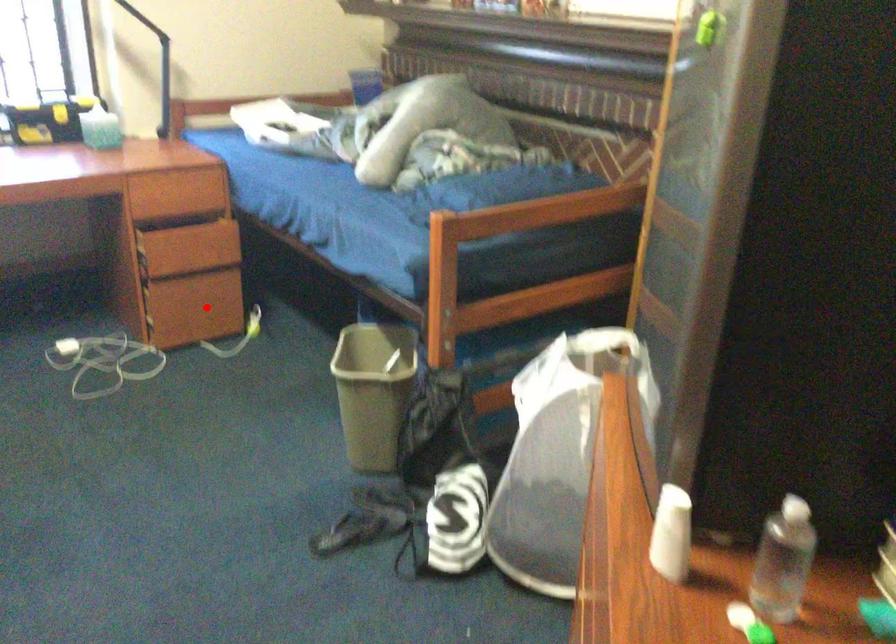
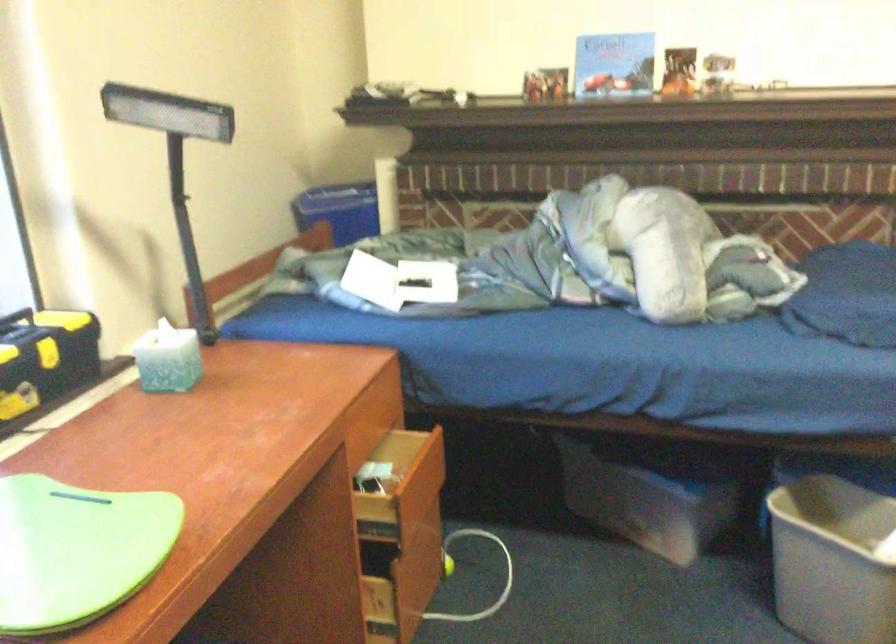
Locate, in the second image, the point that corresponds to the highlighted location in the first image.

(420, 569)